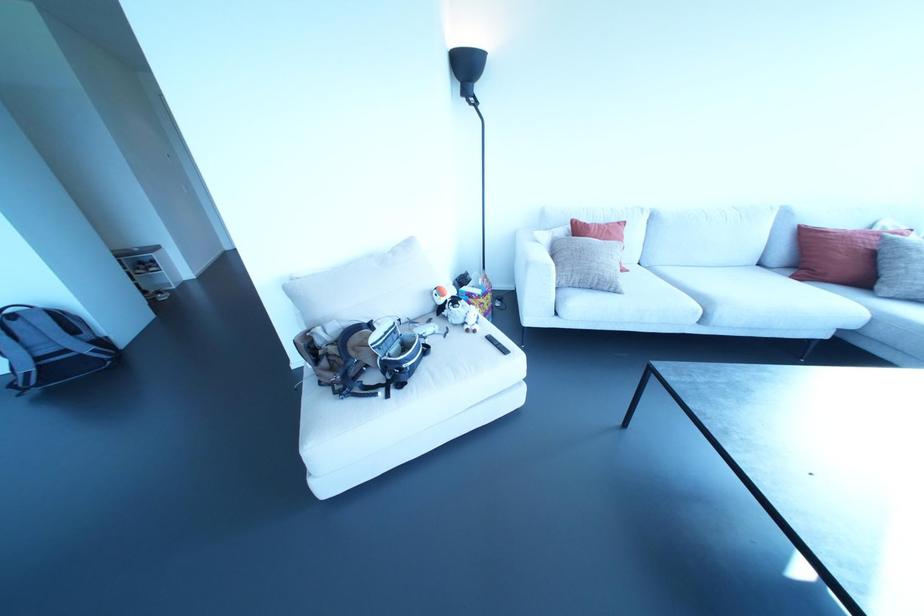
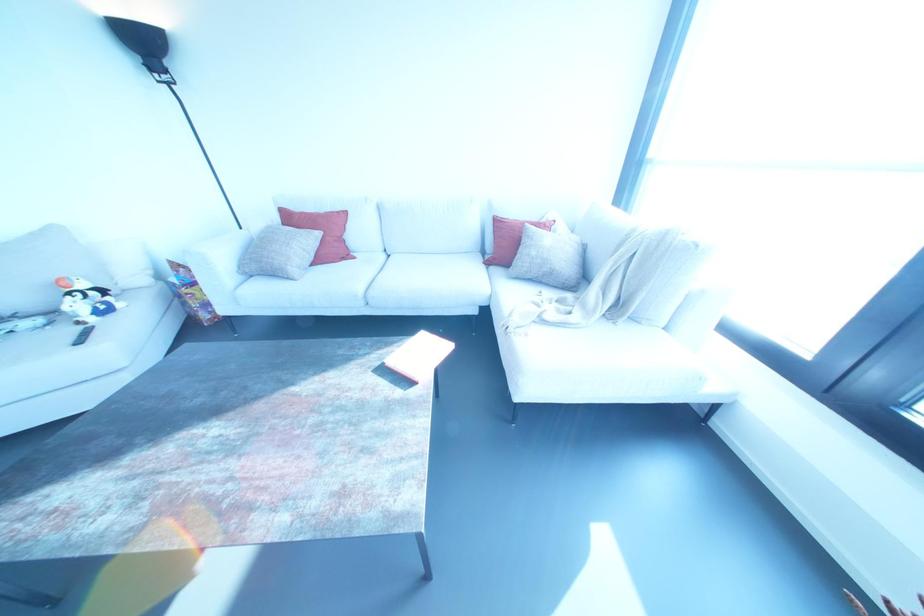
Find the pixel in the second image that matches (504,351) in the first image.

(78, 341)